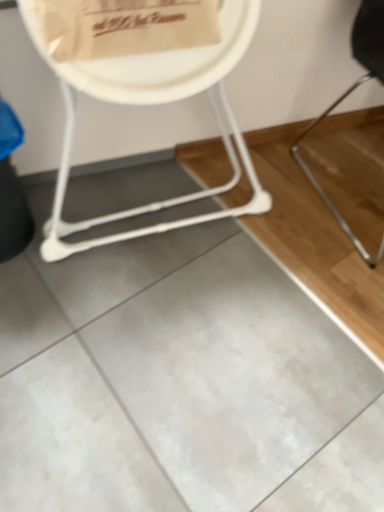
I want to click on vacant space underneath black metal chair at right, the 1th chair positioned from the right (from a real-world perspective), so click(x=357, y=180).